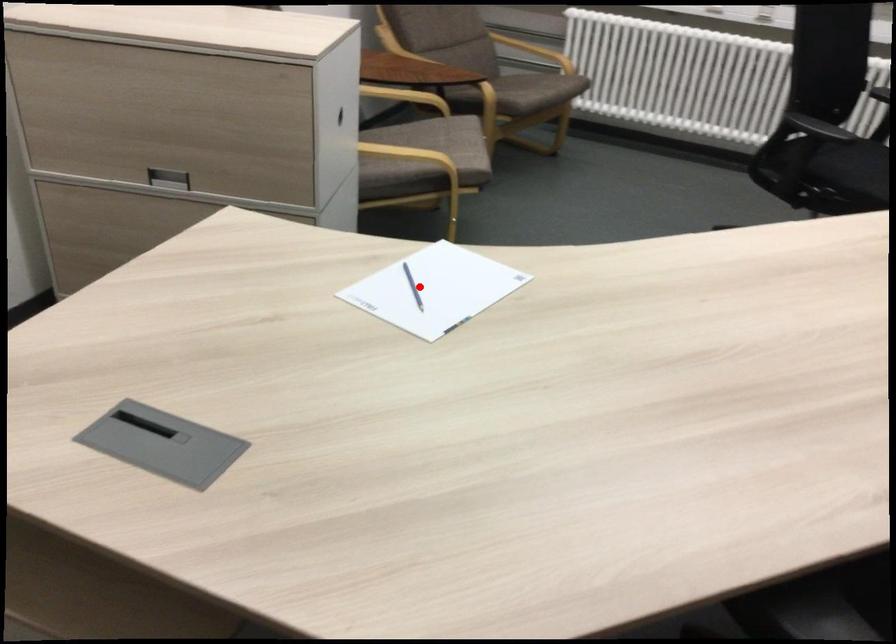
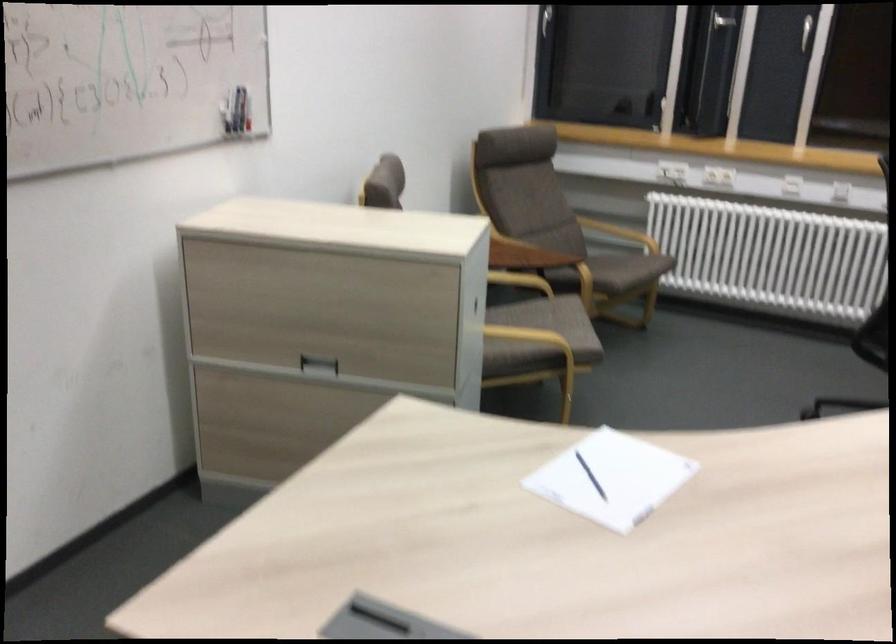
Locate, in the second image, the point that corresponds to the highlighted location in the first image.

(590, 476)